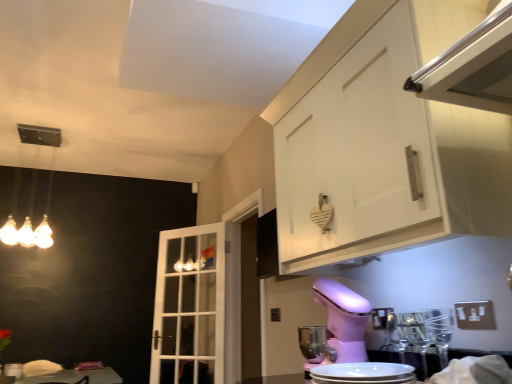
What is the approximate width of white matte cabinet at upper right?

white matte cabinet at upper right is 40.75 centimeters wide.

What do you see at coordinates (344, 319) in the screenshot? Image resolution: width=512 pixels, height=384 pixels. I see `pink plastic mixer at lower center` at bounding box center [344, 319].

Identify the location of pink plastic mixer at lower center. The image size is (512, 384). (344, 319).

This screenshot has width=512, height=384. I want to click on pink plastic stand mixer at lower center, so click(x=362, y=373).

Between white glass door at center and white matte cabinet at upper right, which one has larger width?

white matte cabinet at upper right.

Would you consider white glass door at center to be distant from white matte cabinet at upper right?

That's right, there is a large distance between white glass door at center and white matte cabinet at upper right.

Who is taller, white glass door at center or white matte cabinet at upper right?

white glass door at center is taller.

Which is more to the left, white glass door at center or white matte cabinet at upper right?

white glass door at center.

Relative to pink plastic mixer at lower center, is white matte cabinet at upper right in front or behind?

white matte cabinet at upper right is in front of pink plastic mixer at lower center.

From the image's perspective, which object appears higher, white matte cabinet at upper right or pink plastic mixer at lower center?

white matte cabinet at upper right, from the image's perspective.

Looking at the image, does white matte cabinet at upper right seem bigger or smaller compared to pink plastic mixer at lower center?

In the image, white matte cabinet at upper right appears to be larger than pink plastic mixer at lower center.

You are a GUI agent. You are given a task and a screenshot of the screen. Output one action in this format:
    pyautogui.click(x=<x>, y=<y>)
    Task: Click on the mixer above the white glass door at center (from the image's perspective)
    The width and height of the screenshot is (512, 384).
    Given the screenshot: What is the action you would take?
    pos(344,319)

In terms of size, does pink plastic mixer at lower center appear bigger or smaller than white glass door at center?

Considering their sizes, pink plastic mixer at lower center takes up less space than white glass door at center.

From the image's perspective, between pink plastic mixer at lower center and white glass door at center, which one is located above?

pink plastic mixer at lower center, from the image's perspective.

Does pink plastic mixer at lower center have a lesser width compared to white glass door at center?

No.

Does matte glass light fixture at upper left have a lesser width compared to pink plastic stand mixer at lower center?

No, matte glass light fixture at upper left is not thinner than pink plastic stand mixer at lower center.

Considering the sizes of objects matte glass light fixture at upper left and pink plastic stand mixer at lower center in the image provided, who is shorter, matte glass light fixture at upper left or pink plastic stand mixer at lower center?

pink plastic stand mixer at lower center is shorter.

Is the surface of matte glass light fixture at upper left in direct contact with pink plastic stand mixer at lower center?

No, matte glass light fixture at upper left is not making contact with pink plastic stand mixer at lower center.

Is matte glass light fixture at upper left to the right of pink plastic stand mixer at lower center from the viewer's perspective?

No.

From a real-world perspective, is matte glass light fixture at upper left below white glass door at center?

No.

Which is nearer, [33,178] or [192,243]?

Clearly, point [33,178] is closer to the camera than point [192,243].

In terms of size, does matte glass light fixture at upper left appear bigger or smaller than white glass door at center?

Clearly, matte glass light fixture at upper left is smaller in size than white glass door at center.

In terms of size, does white glass door at center appear bigger or smaller than pink plastic stand mixer at lower center?

Clearly, white glass door at center is larger in size than pink plastic stand mixer at lower center.

How far apart are white glass door at center and pink plastic stand mixer at lower center?

white glass door at center is 8.15 feet away from pink plastic stand mixer at lower center.

Based on the photo, does white glass door at center turn towards pink plastic stand mixer at lower center?

No.

Is pink plastic mixer at lower center taller or shorter than pink plastic stand mixer at lower center?

In the image, pink plastic mixer at lower center appears to be taller than pink plastic stand mixer at lower center.

Which of these two, pink plastic mixer at lower center or pink plastic stand mixer at lower center, is wider?

Wider between the two is pink plastic mixer at lower center.

Who is more distant, pink plastic mixer at lower center or pink plastic stand mixer at lower center?

pink plastic mixer at lower center is further from the camera.

Which is farther from the camera, (318, 295) or (316, 370)?

The point (318, 295) is farther from the camera.

Find the location of a particular element. The height and width of the screenshot is (384, 512). cabinetry on the right of the white glass door at center is located at coordinates (388, 152).

Where is `cabinetry in front of the pink plastic mixer at lower center`? Image resolution: width=512 pixels, height=384 pixels. cabinetry in front of the pink plastic mixer at lower center is located at coordinates tap(388, 152).

Considering their positions, is white matte cabinet at upper right positioned closer to white glass door at center than pink plastic stand mixer at lower center?

white matte cabinet at upper right is closer to white glass door at center.

Which object lies further to the anchor point white glass door at center, white matte cabinet at upper right or pink plastic mixer at lower center?

Among the two, white matte cabinet at upper right is located further to white glass door at center.

When comparing their distances from pink plastic mixer at lower center, does white glass door at center or pink plastic stand mixer at lower center seem closer?

Among the two, pink plastic stand mixer at lower center is located nearer to pink plastic mixer at lower center.

From the image, which object appears to be nearer to matte glass light fixture at upper left, pink plastic stand mixer at lower center or pink plastic mixer at lower center?

Among the two, pink plastic mixer at lower center is located nearer to matte glass light fixture at upper left.

Estimate the real-world distances between objects in this image. Which object is further from pink plastic stand mixer at lower center, pink plastic mixer at lower center or white glass door at center?

The object further to pink plastic stand mixer at lower center is white glass door at center.

Estimate the real-world distances between objects in this image. Which object is closer to pink plastic mixer at lower center, white glass door at center or matte glass light fixture at upper left?

white glass door at center is closer to pink plastic mixer at lower center.

Looking at the image, which one is located closer to pink plastic stand mixer at lower center, pink plastic mixer at lower center or white matte cabinet at upper right?

The object closer to pink plastic stand mixer at lower center is pink plastic mixer at lower center.

Considering their positions, is matte glass light fixture at upper left positioned further to white glass door at center than white matte cabinet at upper right?

The object further to white glass door at center is white matte cabinet at upper right.

Image resolution: width=512 pixels, height=384 pixels. I want to click on mixer located between white matte cabinet at upper right and white glass door at center in the depth direction, so click(344, 319).

What are the coordinates of `appliance located between matte glass light fixture at upper left and white matte cabinet at upper right in the left-right direction` in the screenshot? It's located at (362, 373).

Identify the location of light fixture between white matte cabinet at upper right and white glass door at center in the front-back direction. (34, 193).

Where is `mixer between pink plastic stand mixer at lower center and white glass door at center in the front-back direction`? The width and height of the screenshot is (512, 384). mixer between pink plastic stand mixer at lower center and white glass door at center in the front-back direction is located at coordinates (344, 319).